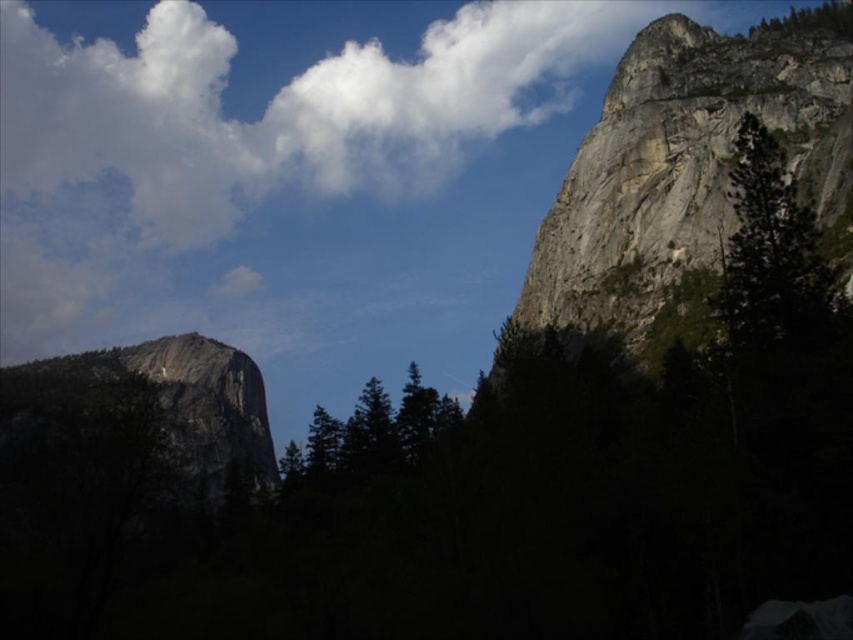
Question: Which of the following is the closest to the observer?

Choices:
 (A) rocky cliff at upper right
 (B) green matte tree at center

Answer: (A)

Question: Which point is closer to the camera?

Choices:
 (A) (55, 38)
 (B) (682, 116)
 (C) (12, 384)

Answer: (B)

Question: Is white fluffy cloud at upper center to the right of green textured tree at upper right from the viewer's perspective?

Choices:
 (A) yes
 (B) no

Answer: (B)

Question: Does white fluffy cloud at upper center have a lesser width compared to green textured tree at upper right?

Choices:
 (A) no
 (B) yes

Answer: (A)

Question: Among these objects, which one is nearest to the camera?

Choices:
 (A) white fluffy cloud at upper center
 (B) green matte tree at center
 (C) rocky cliff at upper right
 (D) rugged granite mountain at left

Answer: (C)

Question: Is white fluffy cloud at upper center to the left of rugged granite mountain at left from the viewer's perspective?

Choices:
 (A) no
 (B) yes

Answer: (A)